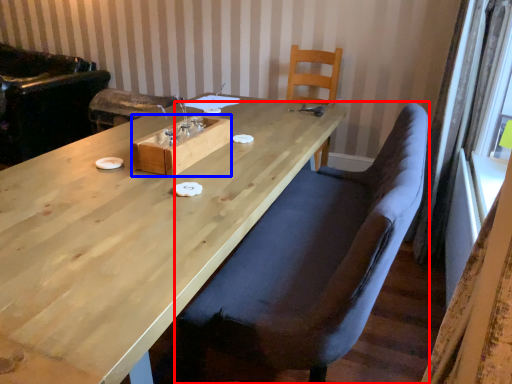
Question: Which object is closer to the camera taking this photo, chair (highlighted by a red box) or wood (highlighted by a blue box)?

Choices:
 (A) chair
 (B) wood

Answer: (A)